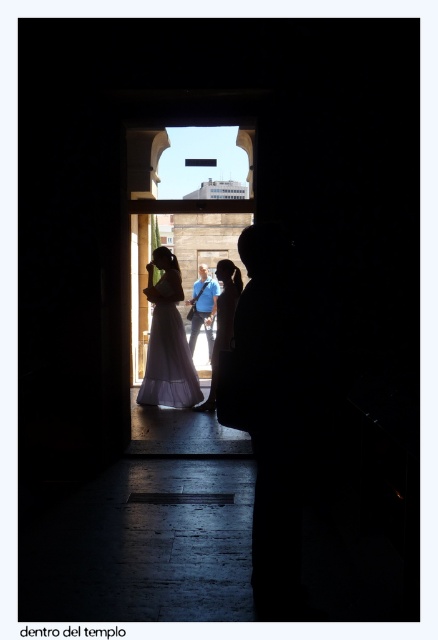
Based on the scene description, what object is located at the coordinates point (x=169, y=364)?

The white tulle dress at center is located at point (x=169, y=364).

You are a photographer trying to capture a group photo of the two people at the center. Given that the white satin dress at center is larger than the blue fabric shirt at center, which one should you focus on to ensure the subject appears more prominent in the photo?

The white satin dress at center has a larger size compared to the blue fabric shirt at center, so focusing on the white satin dress at center will make the subject appear more prominent in the photo.